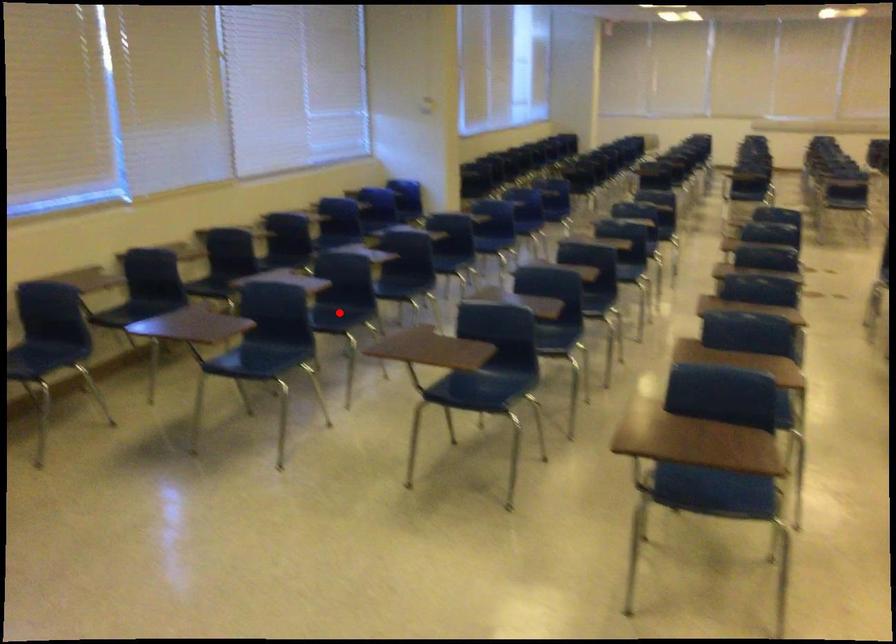
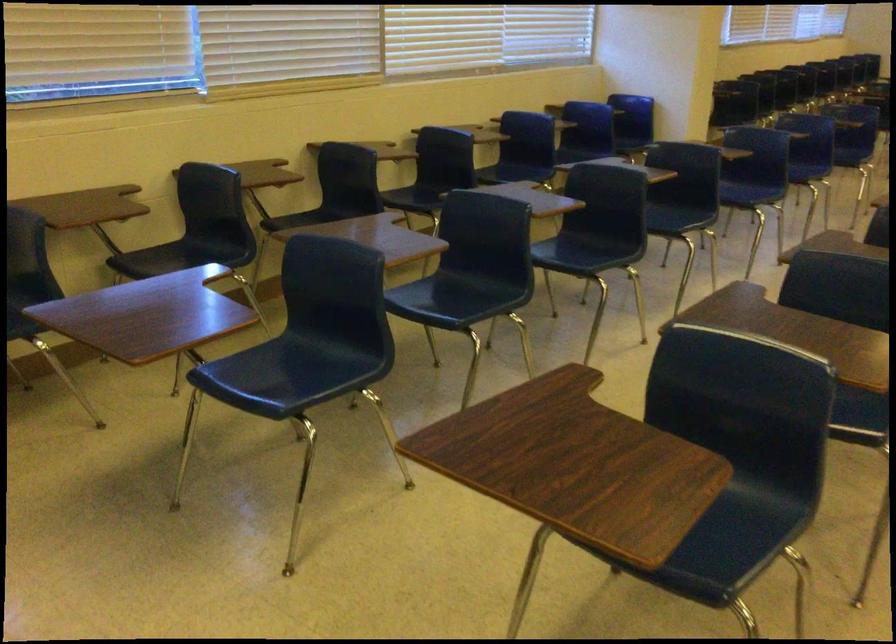
Find the pixel in the second image that matches the highlighted location in the first image.

(462, 292)